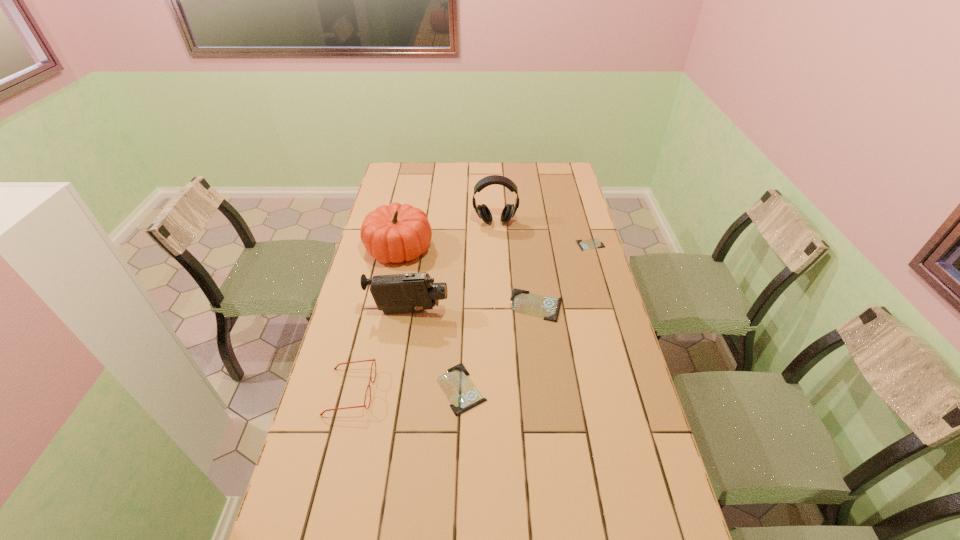
Identify the location of the sixth tallest object. This screenshot has height=540, width=960. (461, 392).

The width and height of the screenshot is (960, 540). I want to click on the second tallest identity card, so click(461, 392).

Find the location of a particular element. Image resolution: width=960 pixels, height=540 pixels. the second identity card from right to left is located at coordinates click(x=523, y=302).

I want to click on the shortest identity card, so click(592, 243).

Locate an element on the screen. This screenshot has width=960, height=540. the rightmost identity card is located at coordinates (592, 243).

This screenshot has height=540, width=960. Identify the location of earphone. (483, 212).

Image resolution: width=960 pixels, height=540 pixels. Find the location of `pumpkin`. pumpkin is located at coordinates (394, 233).

Where is `camcorder`? This screenshot has width=960, height=540. camcorder is located at coordinates (412, 292).

Locate an element on the screen. The width and height of the screenshot is (960, 540). spectacles is located at coordinates (373, 360).

At what (x,y) coordinates should I click in order to perform the action: click on vacant region located on the front of the leftmost identity card. Please return your answer as a coordinate pair (x, y). Looking at the image, I should click on (459, 459).